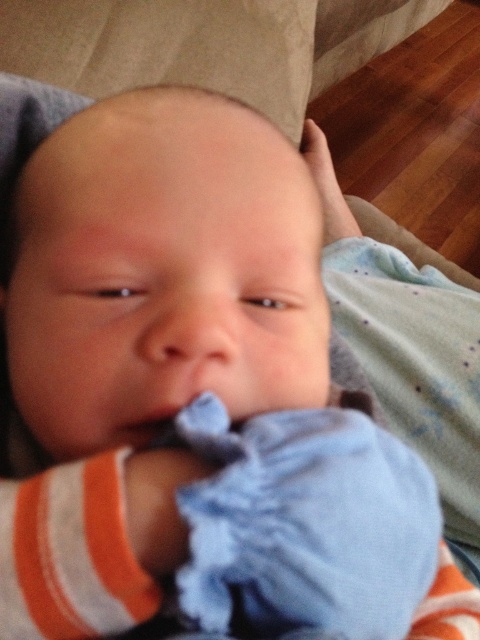
Question: Considering the relative positions of smooth skin nose at center and smooth blue cloth at center in the image provided, where is smooth skin nose at center located with respect to smooth blue cloth at center?

Choices:
 (A) right
 (B) left

Answer: (A)

Question: Is smooth skin nose at center wider than smooth blue cloth at center?

Choices:
 (A) yes
 (B) no

Answer: (A)

Question: From the image, what is the correct spatial relationship of smooth skin nose at center in relation to smooth blue cloth at center?

Choices:
 (A) above
 (B) below

Answer: (A)

Question: Which object is farther from the camera taking this photo?

Choices:
 (A) smooth blue cloth at center
 (B) smooth skin nose at center

Answer: (A)